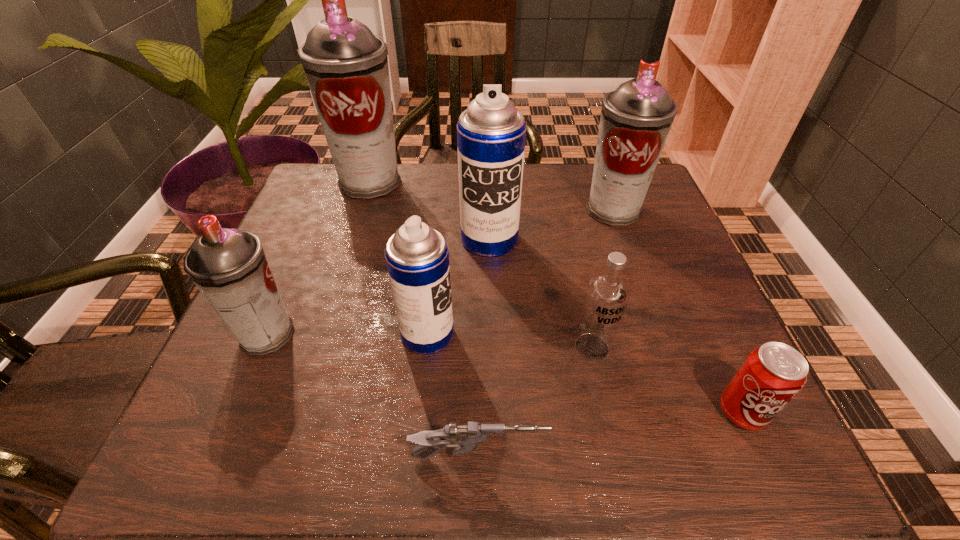
Locate an element on the screen. Image resolution: width=960 pixels, height=540 pixels. the biggest gray aerosol can is located at coordinates (346, 66).

Where is `the tallest object`? the tallest object is located at coordinates (346, 66).

The image size is (960, 540). I want to click on the rightmost aerosol can, so click(x=636, y=118).

Where is `the second smallest gray aerosol can`? The height and width of the screenshot is (540, 960). the second smallest gray aerosol can is located at coordinates (636, 118).

Where is `the farther blue aerosol can`? This screenshot has width=960, height=540. the farther blue aerosol can is located at coordinates (491, 133).

At what (x,y) coordinates should I click in order to perform the action: click on the right blue aerosol can. Please return your answer as a coordinate pair (x, y). Looking at the image, I should click on click(491, 133).

In order to click on the nearer blue aerosol can in this screenshot , I will do `click(417, 257)`.

I want to click on the smaller blue aerosol can, so click(417, 257).

Identify the location of the nearest gray aerosol can. The height and width of the screenshot is (540, 960). (229, 266).

The width and height of the screenshot is (960, 540). I want to click on vodka, so click(607, 293).